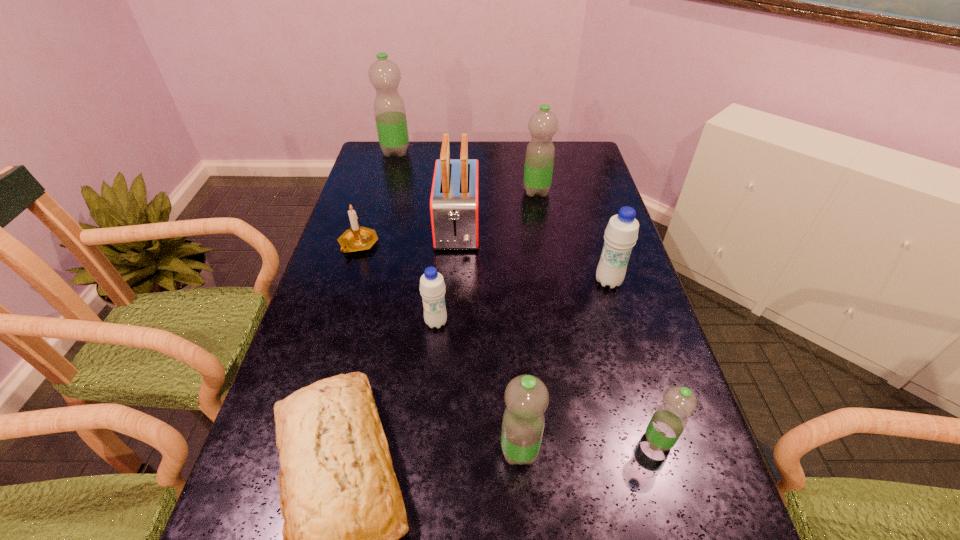
At what (x,y) coordinates should I click in order to perform the action: click on the farthest green water bottle. Please return your answer as a coordinate pair (x, y). This screenshot has height=540, width=960. Looking at the image, I should click on (390, 115).

Identify the location of the leftmost green water bottle. (390, 115).

Where is `the eighth nearest object`? The width and height of the screenshot is (960, 540). the eighth nearest object is located at coordinates (540, 153).

The width and height of the screenshot is (960, 540). Identify the location of the third nearest green water bottle. pyautogui.click(x=540, y=153).

Find the location of `red toaster`. red toaster is located at coordinates (454, 202).

This screenshot has height=540, width=960. I want to click on the third water bottle from left to right, so click(x=526, y=397).

This screenshot has width=960, height=540. In order to click on the fourth object from right to left in this screenshot , I will do `click(526, 397)`.

Identify the location of the farther blue water bottle. (621, 233).

The image size is (960, 540). What are the coordinates of `the bigger blue water bottle` in the screenshot? It's located at (621, 233).

The width and height of the screenshot is (960, 540). Find the location of `the nearer blue water bottle`. the nearer blue water bottle is located at coordinates click(432, 287).